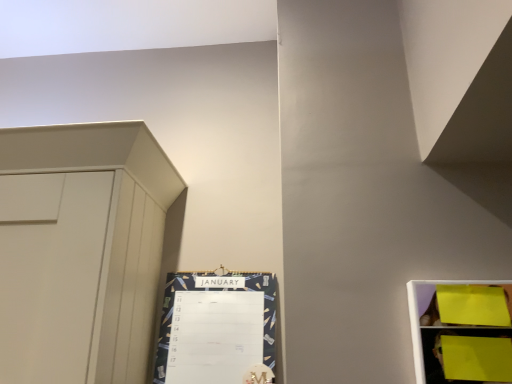
Question: In terms of height, does dark blue textured calendar at center-left look taller or shorter compared to yellow paper at right?

Choices:
 (A) short
 (B) tall

Answer: (B)

Question: Visually, is dark blue textured calendar at center-left positioned to the left or to the right of yellow paper at right?

Choices:
 (A) right
 (B) left

Answer: (B)

Question: From the image's perspective, is dark blue textured calendar at center-left above or below yellow paper at right?

Choices:
 (A) above
 (B) below

Answer: (B)

Question: Considering the positions of point (468, 301) and point (179, 326), is point (468, 301) closer or farther from the camera than point (179, 326)?

Choices:
 (A) farther
 (B) closer

Answer: (B)

Question: Based on their sizes in the image, would you say yellow paper at right is bigger or smaller than dark blue textured calendar at center-left?

Choices:
 (A) big
 (B) small

Answer: (B)

Question: From a real-world perspective, is yellow paper at right positioned above or below dark blue textured calendar at center-left?

Choices:
 (A) above
 (B) below

Answer: (B)

Question: Is yellow paper at right taller or shorter than dark blue textured calendar at center-left?

Choices:
 (A) tall
 (B) short

Answer: (B)